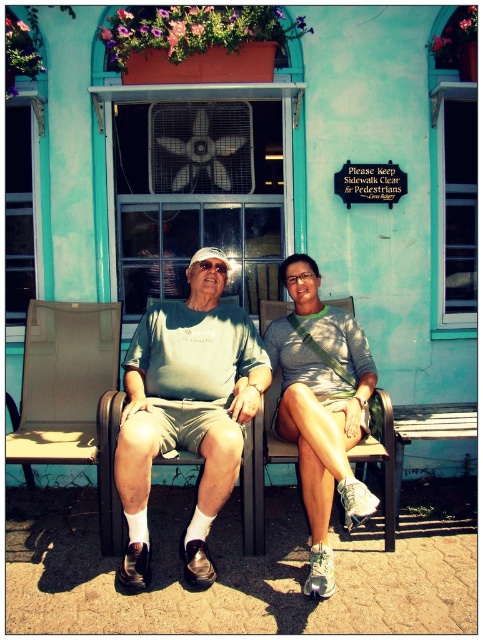
You are a photographer trying to capture a photo of the matte green shirt at center and the matte gray tank top at center. Which one should you focus on first if you want to ensure both are in focus, given that your camera can only focus on one object at a time?

The matte green shirt at center is located above the matte gray tank top at center, so you should focus on the matte green shirt at center first as it is closer to the camera.

You are a photographer trying to capture a group photo of the matte green shirt at center and the matte gray tank top at center. Since you want to ensure both are visible, which direction should you position yourself relative to the subjects to capture both in the frame?

You should position yourself to the right side of the matte green shirt at center and the left side of the matte gray tank top at center to ensure both are visible in the frame.

You are standing in front of the building with a turquoise facade and notice a point at coordinates [184,417]. According to the image, which object from the scene does this point lie on?

The point at coordinates [184,417] lies on the matte green shirt at center.